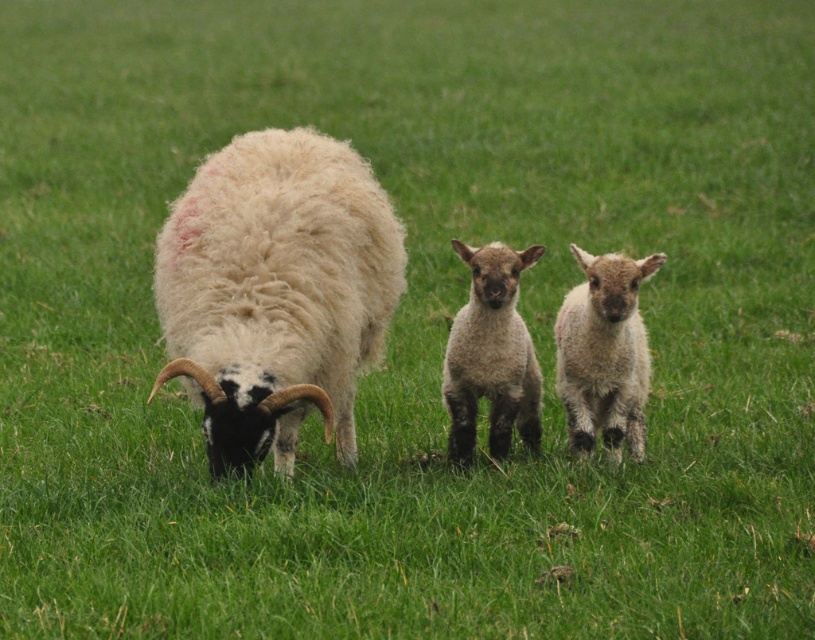
Question: Which object appears farthest from the camera in this image?

Choices:
 (A) fuzzy white lamb at center
 (B) fuzzy woolen sheep at center
 (C) light brown woolly lamb at center

Answer: (C)

Question: Which point is farther to the camera?

Choices:
 (A) fuzzy woolen sheep at center
 (B) fuzzy white lamb at center

Answer: (B)

Question: Is fuzzy woolen sheep at center positioned before fuzzy white lamb at center?

Choices:
 (A) no
 (B) yes

Answer: (B)

Question: Among these points, which one is farthest from the camera?

Choices:
 (A) (302, 134)
 (B) (567, 310)
 (C) (474, 333)

Answer: (B)

Question: Is fuzzy woolen sheep at center smaller than light brown woolly lamb at center?

Choices:
 (A) no
 (B) yes

Answer: (A)

Question: Is fuzzy woolen sheep at center thinner than light brown woolly lamb at center?

Choices:
 (A) no
 (B) yes

Answer: (A)